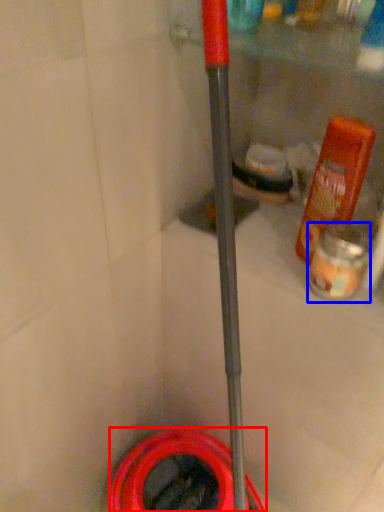
Question: Which object appears farthest to the camera in this image, garden hose (highlighted by a red box) or cleaning product (highlighted by a blue box)?

Choices:
 (A) garden hose
 (B) cleaning product

Answer: (A)